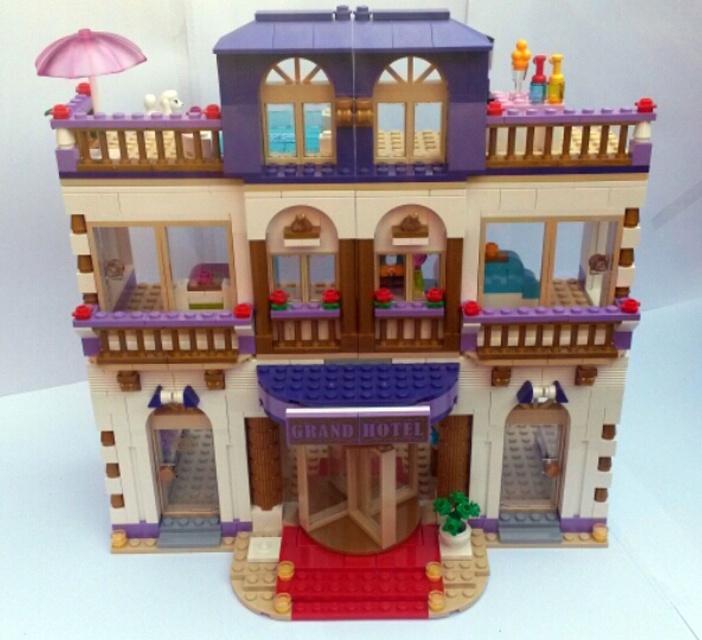
You are a guest at the GRAND HOTEL LEGO model and want to place a small LEGO figure on the highest translucent yellow object. Which object should you choose between the translucent yellow toy at upper right and the translucent yellow plastic cup at upper center?

The translucent yellow toy at upper right is located above the translucent yellow plastic cup at upper center, so you should place the LEGO figure on the translucent yellow toy at upper right as it is the higher one.

You are a guest at the GRAND HOTEL LEGO model and want to place a small LEGO figure on the red carpet leading to the entrance. You have two options for placement near the translucent yellow plastic toy at upper right and the pink plastic umbrella at upper left. Which object will the figure be closer to if placed on the red carpet?

The translucent yellow plastic toy at upper right is closer to the red carpet because it is further to the viewer than the pink plastic umbrella at upper left, meaning it is physically nearer in the scene.